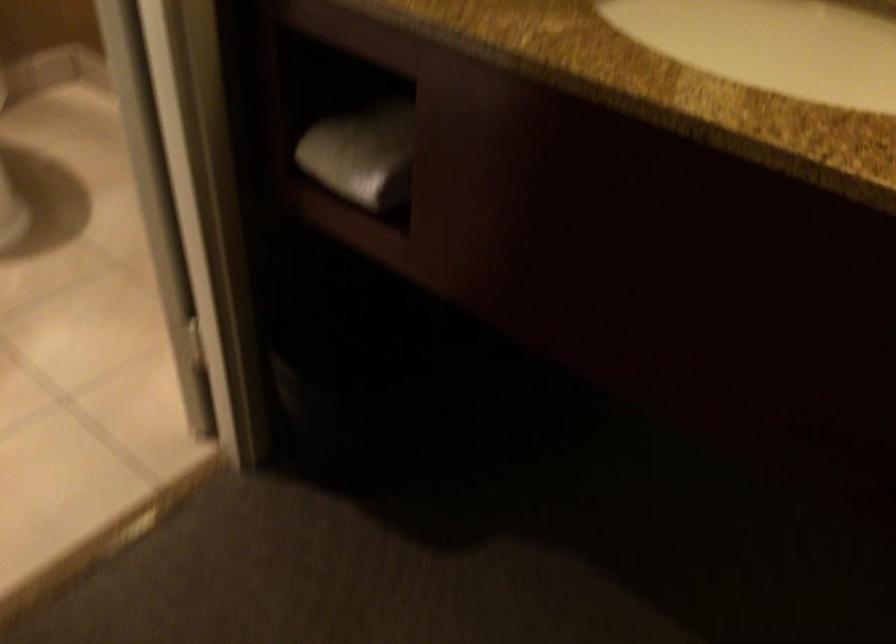
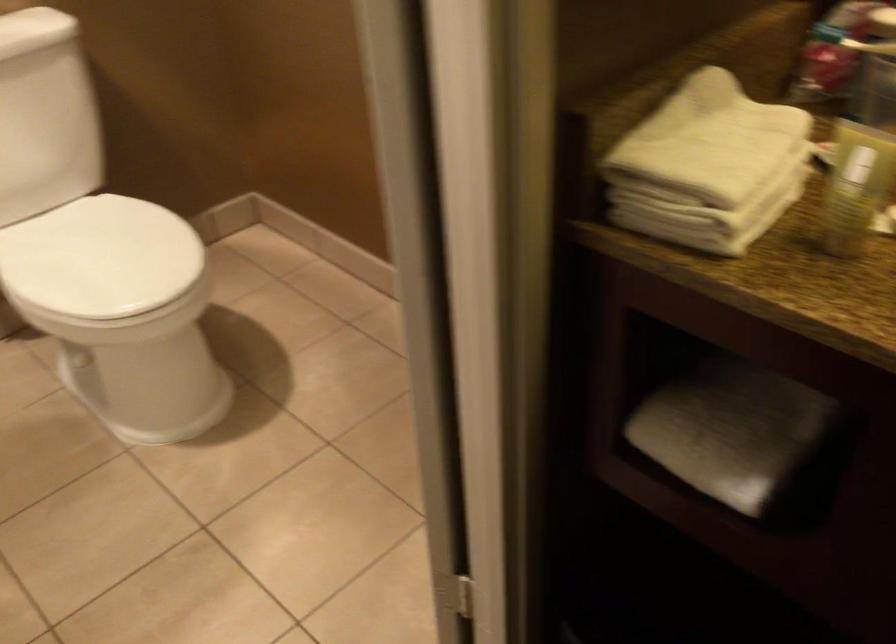
Find the pixel in the second image that matches (366,146) in the first image.

(730, 431)